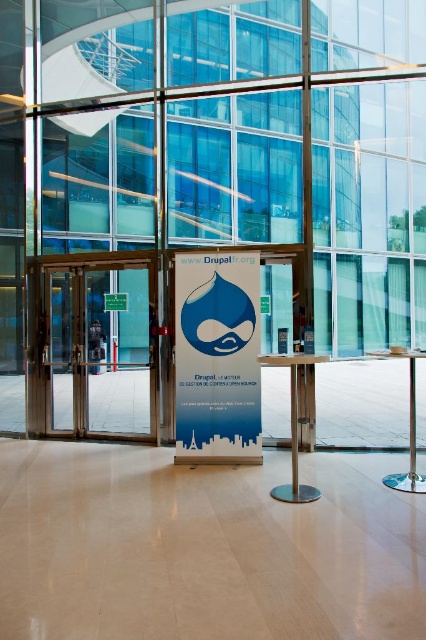
Consider the image. Who is higher up, transparent glass door at center or green plastic sign at center?

green plastic sign at center

Identify the location of transparent glass door at center. (100, 348).

Who is more distant from viewer, (77, 433) or (108, 294)?

Point (77, 433)

Identify the location of transparent glass door at center. (100, 348).

Is point (91, 355) positioned after point (215, 349)?

Yes, point (91, 355) is behind point (215, 349).

Consider the image. Can you confirm if transparent glass door at center is shorter than blue paper sign at center?

No, transparent glass door at center is not shorter than blue paper sign at center.

Between point (54, 304) and point (209, 333), which one is positioned behind?

The point (54, 304) is more distant.

The image size is (426, 640). Find the location of `transparent glass door at center`. transparent glass door at center is located at coordinates (100, 348).

Does blue paper sign at center have a larger size compared to green plastic sign at center?

Yes, blue paper sign at center is bigger than green plastic sign at center.

Is blue paper sign at center smaller than green plastic sign at center?

No.

Image resolution: width=426 pixels, height=640 pixels. What do you see at coordinates (218, 356) in the screenshot?
I see `blue paper sign at center` at bounding box center [218, 356].

Identify the location of blue paper sign at center. The image size is (426, 640). (218, 356).